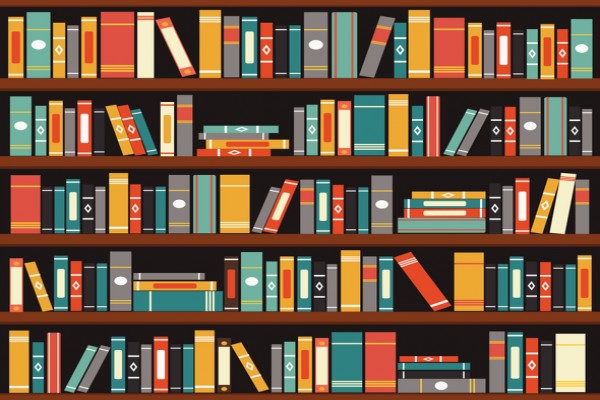
Identify the location of shelves. The image size is (600, 400). (244, 82), (250, 162), (253, 241), (247, 319), (271, 398).